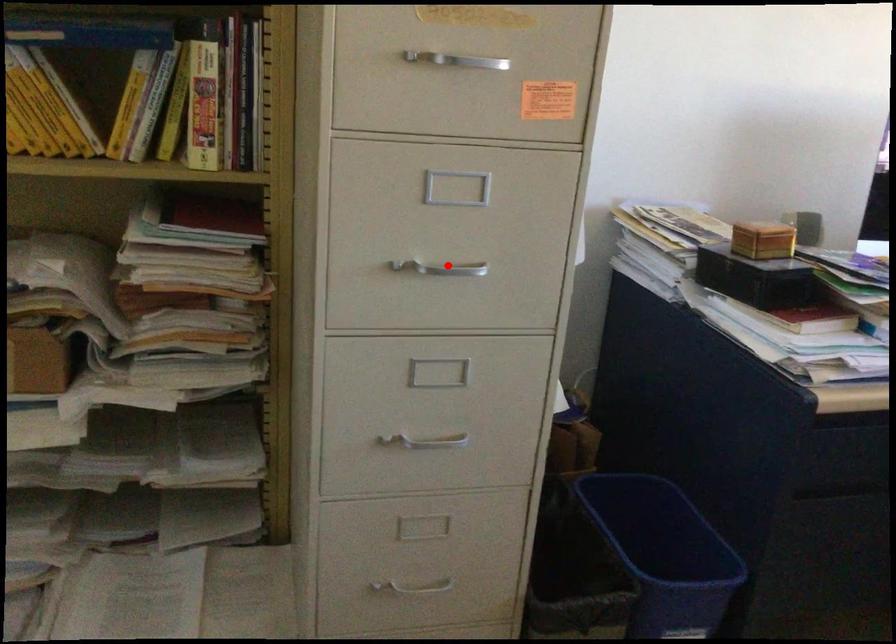
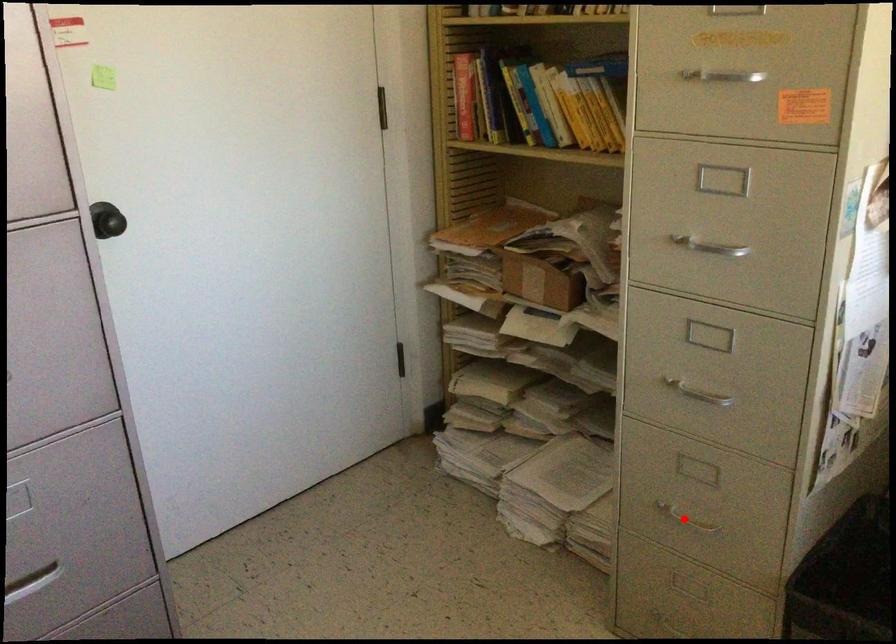
I am providing you with two images of the same scene from different viewpoints. A red point is marked on the first image and another point is marked on the second image. Does the point marked in image1 correspond to the same location as the one in image2?

No